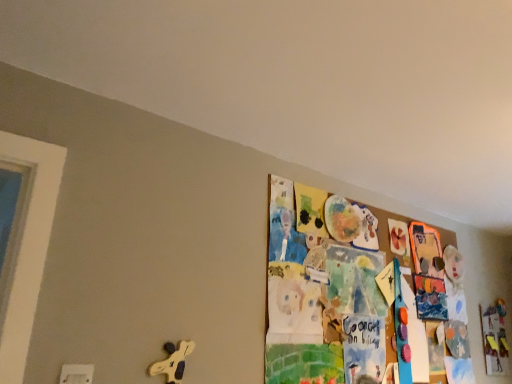
The width and height of the screenshot is (512, 384). I want to click on white plastic light switch at lower left, so (76, 374).

Image resolution: width=512 pixels, height=384 pixels. What do you see at coordinates (76, 374) in the screenshot?
I see `white plastic light switch at lower left` at bounding box center [76, 374].

Identify the location of white plastic light switch at lower left. The height and width of the screenshot is (384, 512). (76, 374).